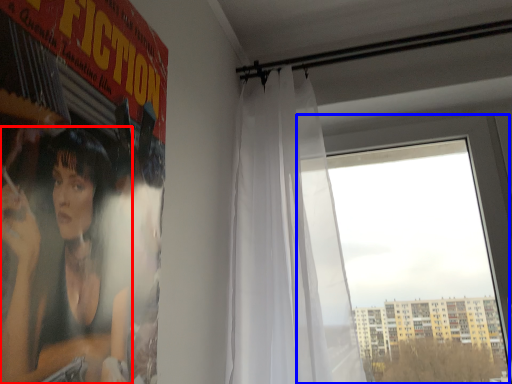
Question: Which object is closer to the camera taking this photo, person (highlighted by a red box) or window (highlighted by a blue box)?

Choices:
 (A) person
 (B) window

Answer: (A)